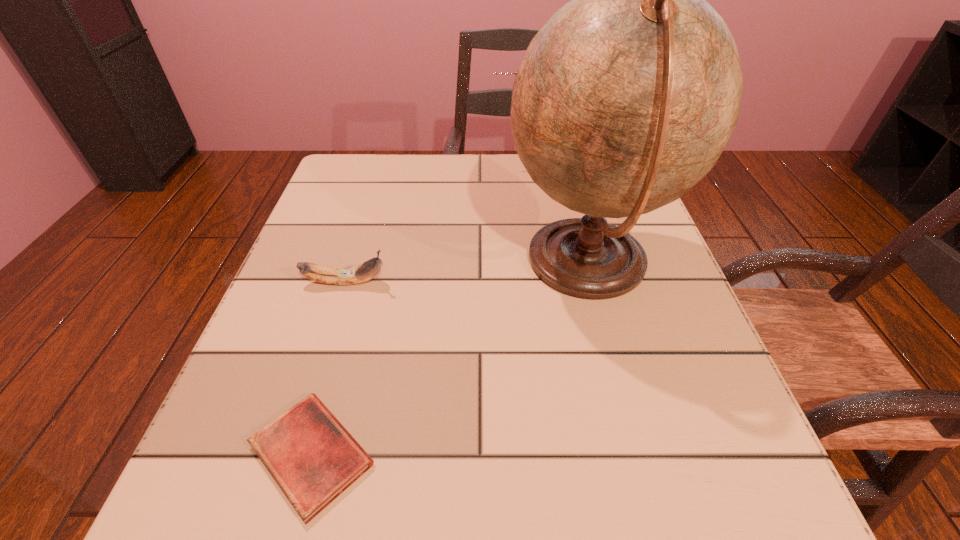
Identify the location of globe. (625, 99).

The height and width of the screenshot is (540, 960). Find the location of `the second tallest object`. the second tallest object is located at coordinates (515, 73).

Where is `the farthest object`? the farthest object is located at coordinates (515, 73).

Locate an element on the screen. The image size is (960, 540). banana is located at coordinates (360, 273).

Find the location of a particular element. This screenshot has width=960, height=540. the shortest object is located at coordinates 311,456.

Find the location of a particular element. The image size is (960, 540). the nearest object is located at coordinates (311, 456).

Where is `vacant position located on the front-facing side of the tallest object`? The width and height of the screenshot is (960, 540). vacant position located on the front-facing side of the tallest object is located at coordinates (451, 264).

I want to click on vacant area located 0.050m on the front-facing side of the tallest object, so click(477, 264).

Locate an element on the screen. Image resolution: width=960 pixels, height=540 pixels. vacant space situated on the front-facing side of the tallest object is located at coordinates (309, 264).

Where is `free space located 0.060m on the handle side of the farthest object`? free space located 0.060m on the handle side of the farthest object is located at coordinates (467, 164).